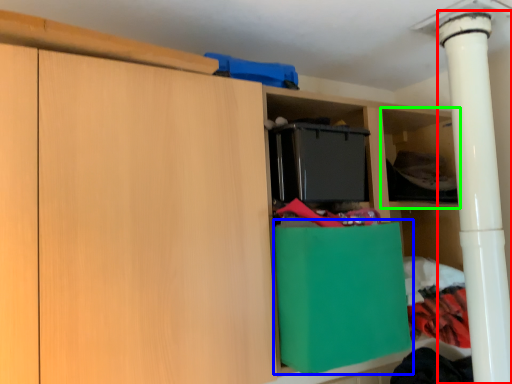
Question: Which object is the farthest from pillar (highlighted by a red box)? Choose among these: cabinetry (highlighted by a blue box) or shelf (highlighted by a green box).

Choices:
 (A) cabinetry
 (B) shelf

Answer: (A)